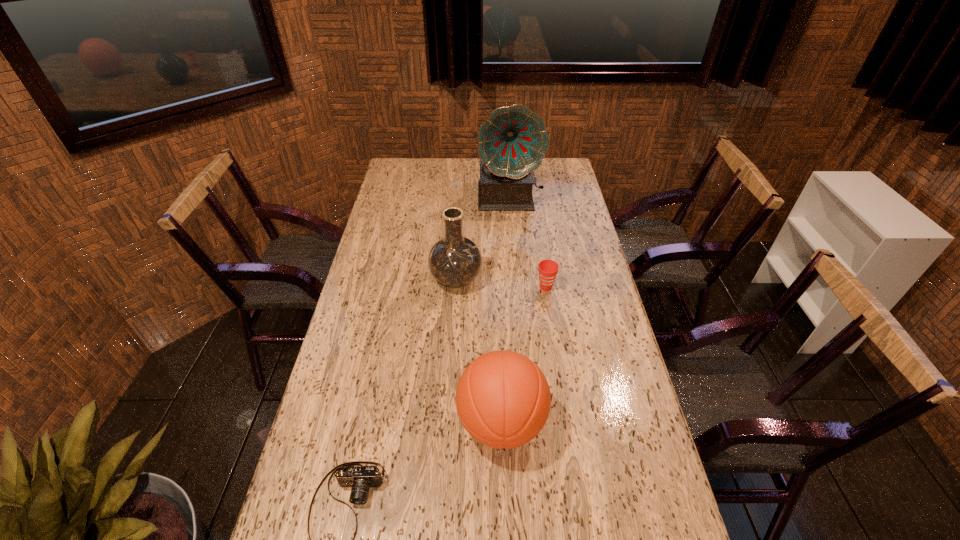
Identify the location of object that stands as the second closest to the third shortest object. Image resolution: width=960 pixels, height=540 pixels. (455, 261).

Identify which object is the fourth closest to the tallest object. Please provide its 2D coordinates. Your answer should be formatted as a tuple, i.e. [(x, y)], where the tuple contains the x and y coordinates of a point satisfying the conditions above.

[(360, 478)]